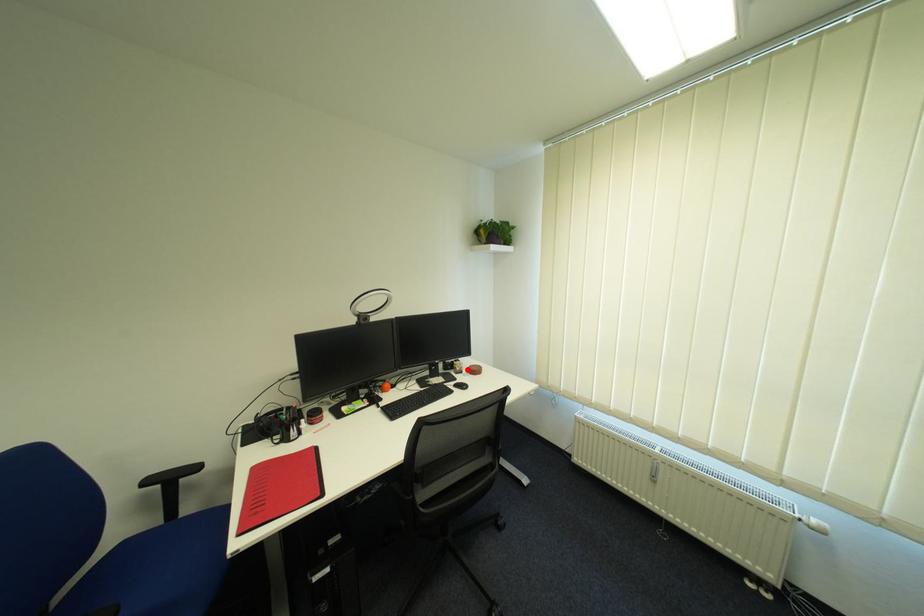
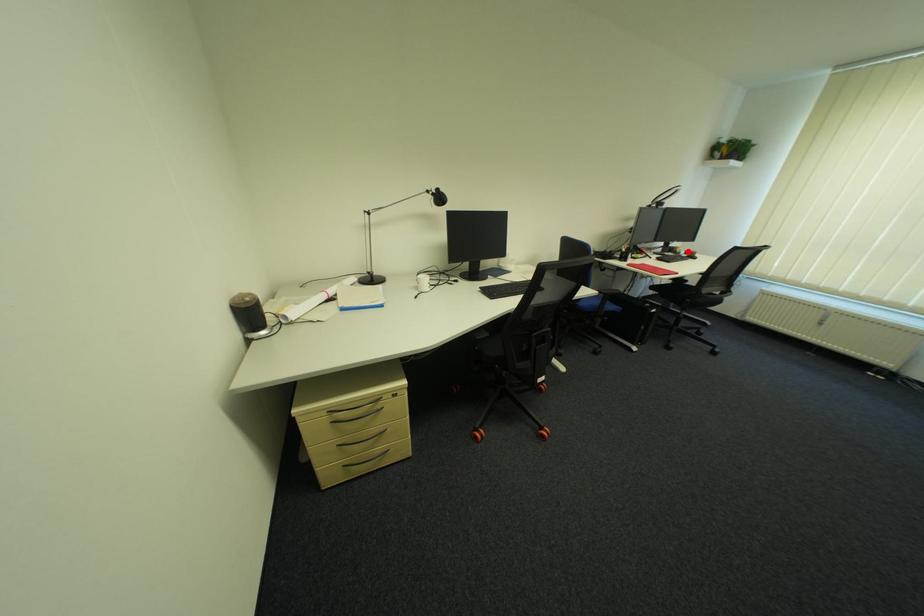
I am providing you with two images of the same scene from different viewpoints. A red point is marked on the first image and another point is marked on the second image. Does the point marked in image1 correspond to the same location as the one in image2?

Yes